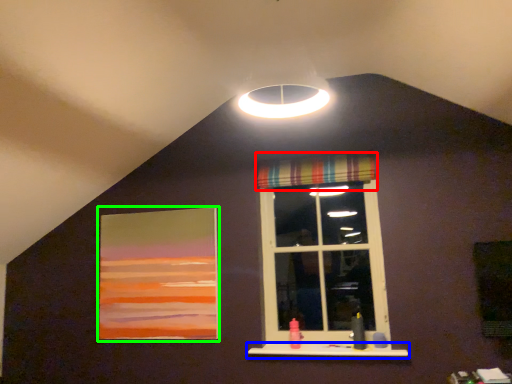
Question: Which object is the closest to the curtain (highlighted by a red box)? Choose among these: window sill (highlighted by a blue box) or picture frame (highlighted by a green box).

Choices:
 (A) window sill
 (B) picture frame

Answer: (B)